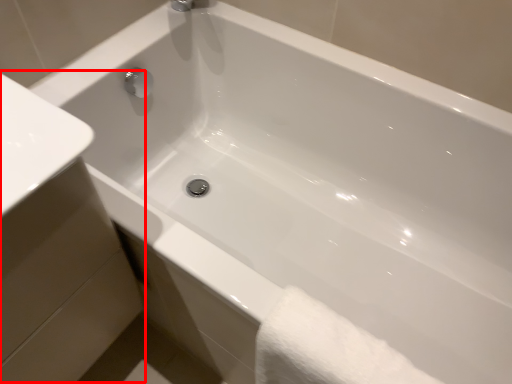
Question: Considering the relative positions of sink (annotated by the red box) and bath towel in the image provided, where is sink (annotated by the red box) located with respect to the staircase?

Choices:
 (A) left
 (B) right

Answer: (A)